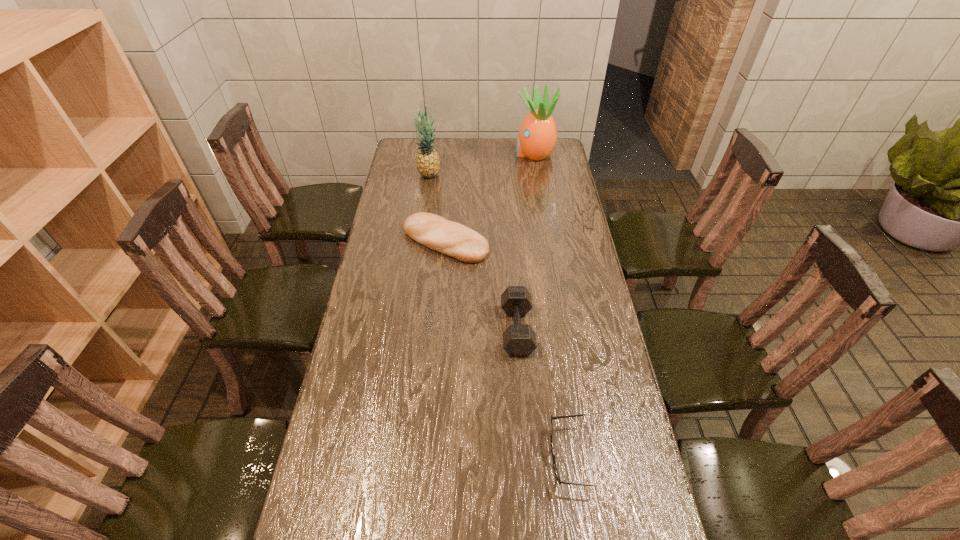
I want to click on pineapple that is at the right edge, so click(537, 137).

Image resolution: width=960 pixels, height=540 pixels. What are the coordinates of `spectacles located at the right edge` in the screenshot? It's located at (557, 417).

You are a GUI agent. You are given a task and a screenshot of the screen. Output one action in this format:
    pyautogui.click(x=<x>, y=<y>)
    Task: Click on the object located in the far right corner section of the desktop
    The width and height of the screenshot is (960, 540).
    Given the screenshot: What is the action you would take?
    [537, 137]

In the image, there is a desktop. At what (x,y) coordinates should I click in order to perform the action: click on vacant space at the far edge. Please return your answer as a coordinate pair (x, y). The image size is (960, 540). Looking at the image, I should click on click(447, 147).

The width and height of the screenshot is (960, 540). In the image, there is a desktop. Find the location of `vacant space at the left edge`. vacant space at the left edge is located at coordinates (413, 179).

In the image, there is a desktop. Where is `free space at the right edge`? The image size is (960, 540). free space at the right edge is located at coordinates (546, 220).

Find the location of a particular element. free space between the nearest object and the farther pineapple is located at coordinates (551, 305).

Identify the location of free spot between the farthest object and the third nearest object. (490, 198).

I want to click on vacant point located between the left pineapple and the right pineapple, so click(x=481, y=164).

Find the location of `free spot between the second farthest object and the farther pineapple`. free spot between the second farthest object and the farther pineapple is located at coordinates (481, 164).